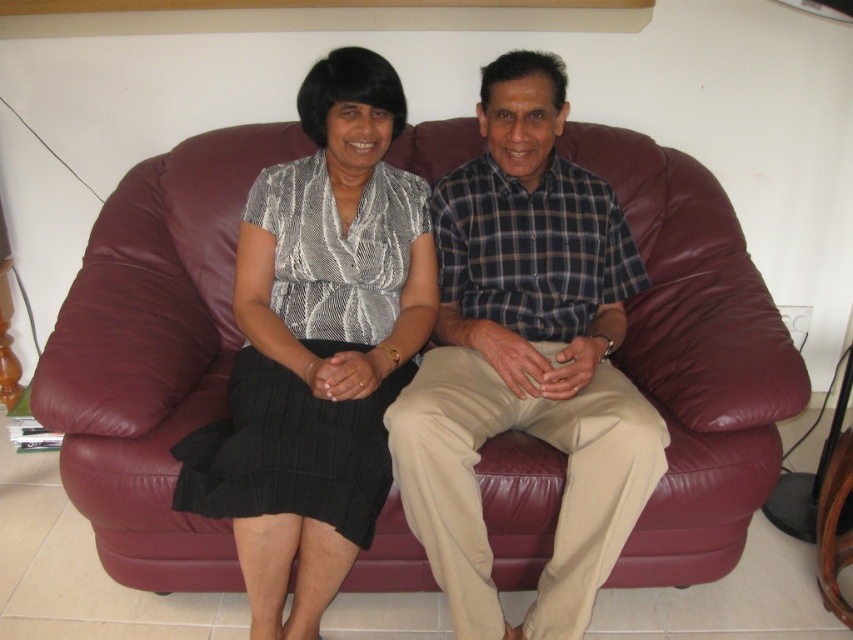
You are designing a room layout where the maroon leather couch at center and the plaid cotton shirt at center need to be placed. Considering their sizes, which object should be placed lower to the ground?

The maroon leather couch at center should be placed lower to the ground since it has a lesser height compared to the plaid cotton shirt at center.

You are taking a photo of two people sitting on a sofa in a living room. You notice two points marked on the sofa. One is at coordinate point (546,435) and the other is at point (415,342). Which point is closer to the camera?

Point (546,435) is closer to the camera than point (415,342).

You are standing in the living room and want to place a small table exactly at point [154,353]. Is there enough space to place the table there?

The point [154,353] is where the maroon leather couch at center is located, so there is no space to place the table there.